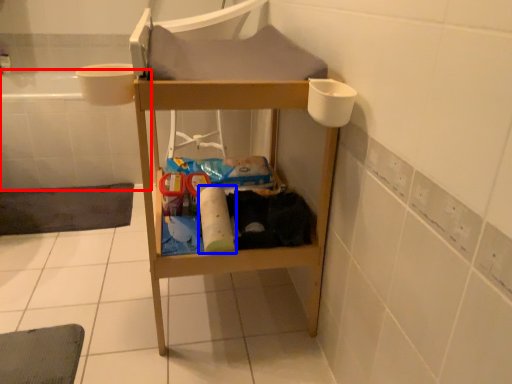
Question: Which object is further to the camera taking this photo, bath (highlighted by a red box) or toilet paper (highlighted by a blue box)?

Choices:
 (A) bath
 (B) toilet paper

Answer: (A)